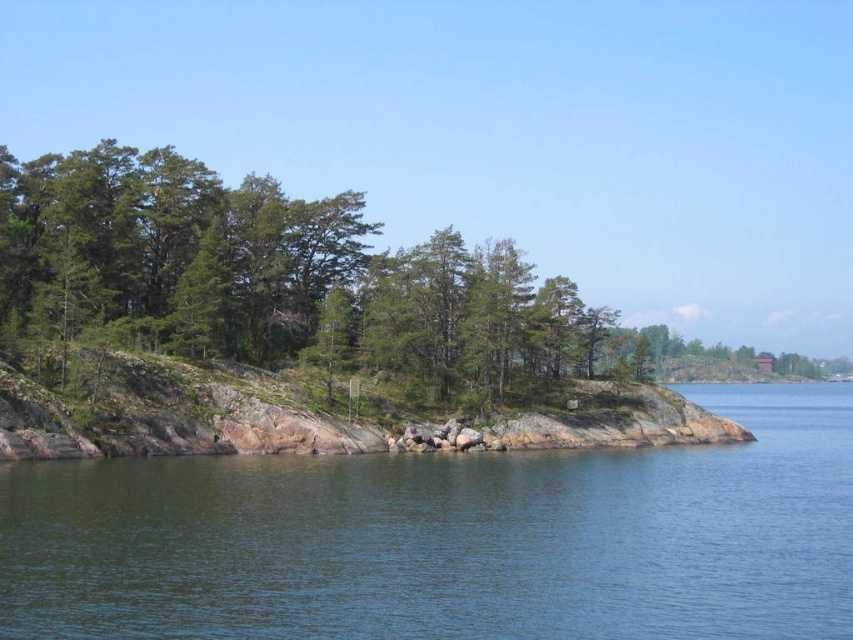
You are standing at the edge of the rocky shoreline and want to reach the clear blue water at lower left. Which direction should you move relative to the green leafy trees at center?

To reach the clear blue water at lower left from the green leafy trees at center, you should move to the right since the clear blue water at lower left is positioned to the right of the green leafy trees at center.

You are a hiker standing at the edge of the clear blue water at lower left. You want to reach the green leafy trees at center. Which direction should you move to get closer to the trees?

The clear blue water at lower left is shorter than the green leafy trees at center, so you should move towards the center direction to get closer to the green leafy trees at center.

You are a hiker trying to cross the rocky shoreline. You see the clear blue water at lower left and the green leafy trees at center. Which area has a larger area to walk on?

The green leafy trees at center have a larger area to walk on since the clear blue water at lower left has a smaller size compared to them.